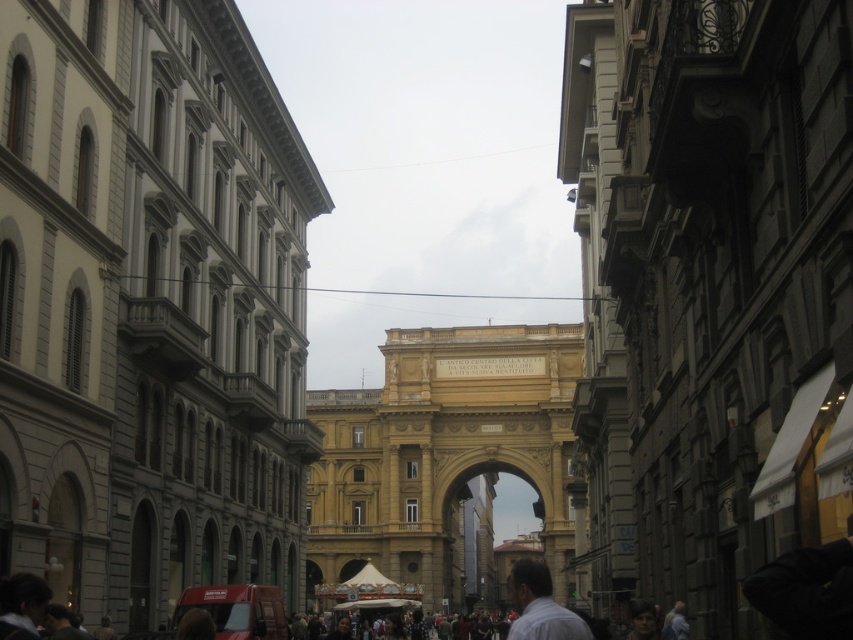
Is yellow stone archway at center smaller than dark brown hair at lower left?

Incorrect, yellow stone archway at center is not smaller in size than dark brown hair at lower left.

This screenshot has width=853, height=640. What do you see at coordinates (486, 534) in the screenshot? I see `yellow stone archway at center` at bounding box center [486, 534].

The image size is (853, 640). In order to click on yellow stone archway at center in this screenshot , I will do `click(486, 534)`.

Measure the distance between dark brown hair at lower left and camera.

dark brown hair at lower left is 45.52 meters away from camera.

Based on the photo, is dark brown hair at lower left below light brown hair at lower right?

No.

Identify the location of dark brown hair at lower left. (21, 605).

The image size is (853, 640). Find the location of `dark brown hair at lower left`. dark brown hair at lower left is located at coordinates (21, 605).

Between light blue shirt at lower center and dark brown hair at lower left, which one appears on the left side from the viewer's perspective?

From the viewer's perspective, dark brown hair at lower left appears more on the left side.

Which is more to the right, light blue shirt at lower center or dark brown hair at lower left?

Positioned to the right is light blue shirt at lower center.

This screenshot has width=853, height=640. I want to click on light blue shirt at lower center, so click(x=540, y=605).